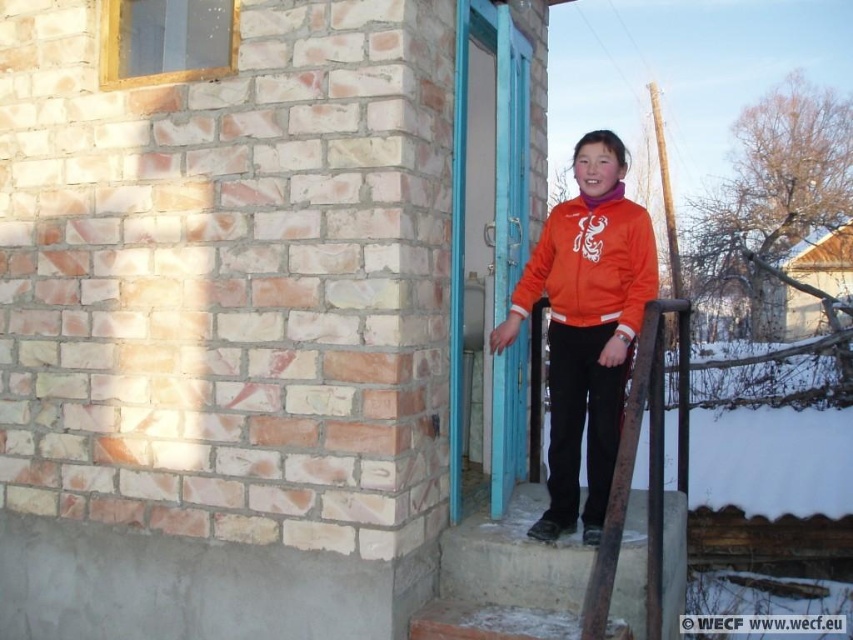
Question: Observing the image, what is the correct spatial positioning of orange fleece jacket at center in reference to orange fleece sweatshirt at center?

Choices:
 (A) left
 (B) right

Answer: (B)

Question: Observing the image, what is the correct spatial positioning of orange fleece jacket at center in reference to orange fleece sweatshirt at center?

Choices:
 (A) left
 (B) right

Answer: (B)

Question: Which of the following is the farthest from the observer?

Choices:
 (A) orange fleece sweatshirt at center
 (B) orange fleece jacket at center

Answer: (A)

Question: Does orange fleece jacket at center appear under orange fleece sweatshirt at center?

Choices:
 (A) yes
 (B) no

Answer: (A)

Question: Among these objects, which one is nearest to the camera?

Choices:
 (A) orange fleece jacket at center
 (B) orange fleece sweatshirt at center

Answer: (A)